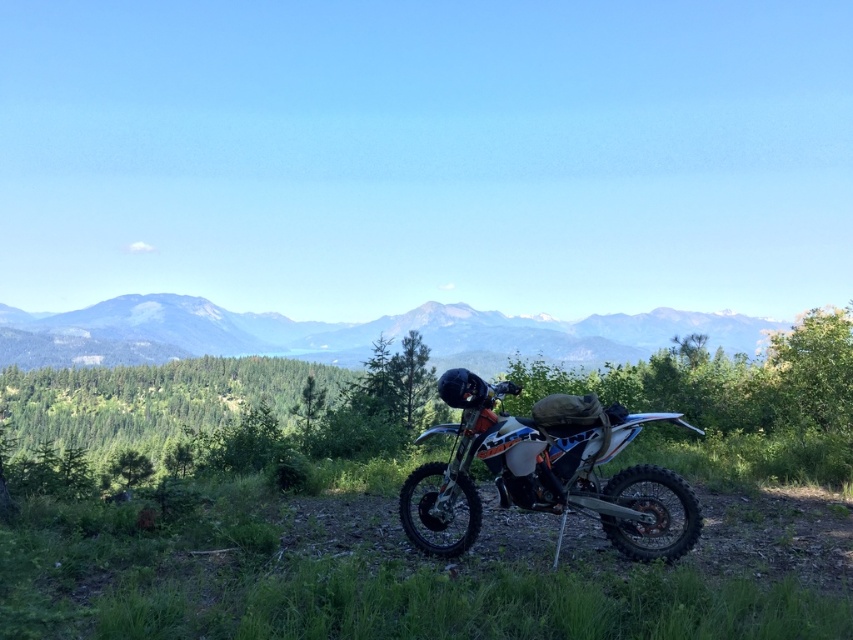
Does green forested mountain at center appear on the right side of matte black motorcycle at center?

In fact, green forested mountain at center is to the left of matte black motorcycle at center.

What do you see at coordinates (347, 333) in the screenshot? I see `green forested mountain at center` at bounding box center [347, 333].

Between point (460, 316) and point (436, 509), which one is positioned behind?

The point (460, 316) is more distant.

You are a GUI agent. You are given a task and a screenshot of the screen. Output one action in this format:
    pyautogui.click(x=<x>, y=<y>)
    Task: Click on the green forested mountain at center
    The width and height of the screenshot is (853, 640).
    Given the screenshot: What is the action you would take?
    pyautogui.click(x=347, y=333)